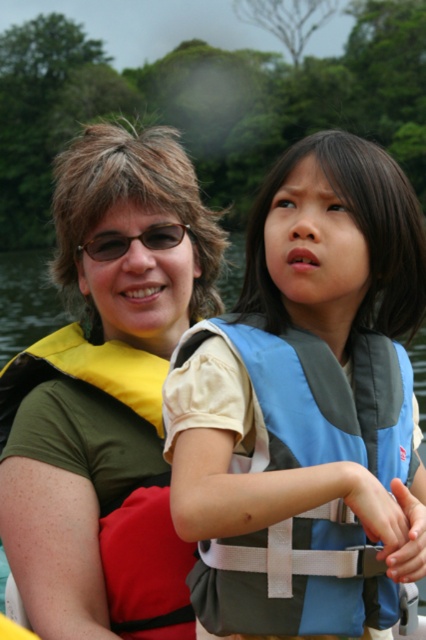
Question: Which of the following is the farthest from the observer?

Choices:
 (A) yellow fabric life vest at left
 (B) matte black glasses at upper center

Answer: (B)

Question: Does yellow fabric life vest at left lie behind matte black glasses at upper center?

Choices:
 (A) yes
 (B) no

Answer: (B)

Question: Among these points, which one is nearest to the camera?

Choices:
 (A) (288, 577)
 (B) (123, 250)

Answer: (A)

Question: Which point is farther from the camera taking this photo?

Choices:
 (A) (215, 269)
 (B) (178, 515)

Answer: (A)

Question: Does blue fabric life vest at center appear over matte black glasses at upper center?

Choices:
 (A) yes
 (B) no

Answer: (B)

Question: Can you confirm if blue fabric life vest at center is positioned to the right of yellow fabric life vest at left?

Choices:
 (A) yes
 (B) no

Answer: (A)